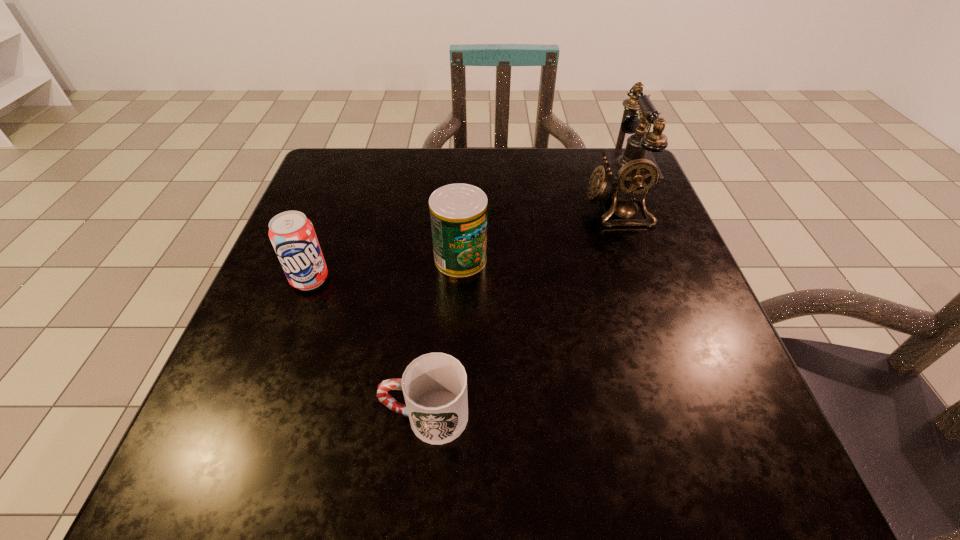
Locate an element on the screen. The height and width of the screenshot is (540, 960). the rightmost object is located at coordinates (628, 176).

What are the coordinates of `the tallest object` in the screenshot? It's located at (628, 176).

Find the location of a particular element. The image size is (960, 540). can is located at coordinates (458, 212).

At what (x,y) coordinates should I click in order to perform the action: click on the leftmost object. Please return your answer as a coordinate pair (x, y). This screenshot has width=960, height=540. Looking at the image, I should click on (292, 235).

The width and height of the screenshot is (960, 540). I want to click on cup, so click(x=434, y=385).

Locate an element on the screen. The image size is (960, 540). the nearest object is located at coordinates (434, 385).

Image resolution: width=960 pixels, height=540 pixels. Find the location of `vacant area situated on the rotary dial of the telephone`. vacant area situated on the rotary dial of the telephone is located at coordinates (468, 205).

Find the location of a particular element. vacant space situated 0.160m on the rotary dial of the telephone is located at coordinates (513, 205).

Identify the location of blank space located on the rotary dial of the telephone. click(409, 205).

At what (x,y) coordinates should I click in order to perform the action: click on vacant space located 0.050m on the right of the can. Please return your answer as a coordinate pair (x, y). The height and width of the screenshot is (540, 960). Looking at the image, I should click on (513, 259).